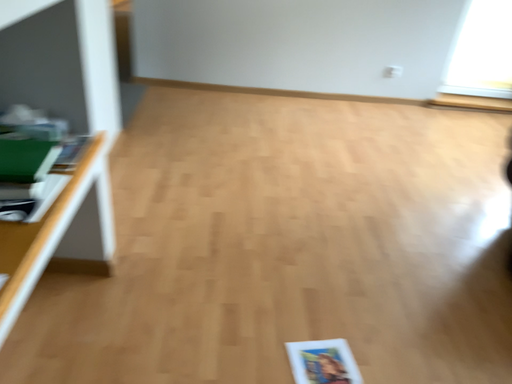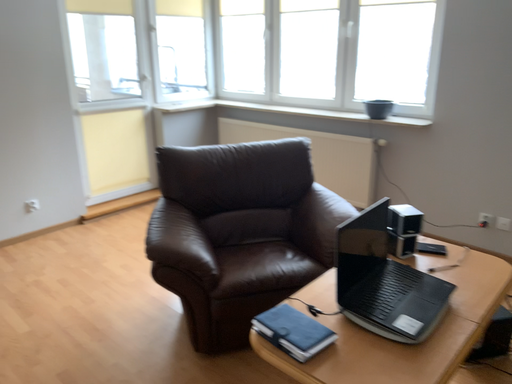
Question: How did the camera likely rotate when shooting the video?

Choices:
 (A) rotated left
 (B) rotated right

Answer: (B)